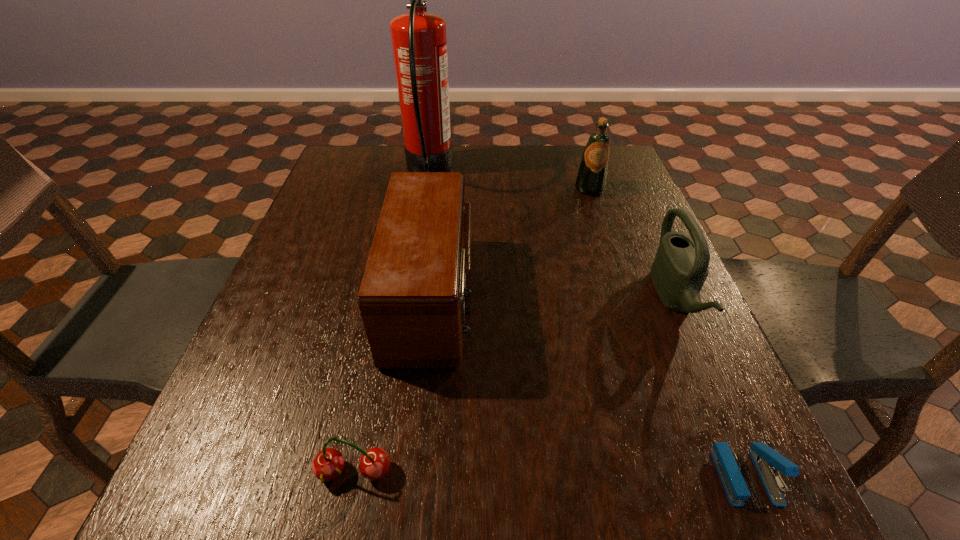
At what (x,y) coordinates should I click in order to perform the action: click on empty space between the radio receiver and the third object from right to left. Please return your answer as a coordinate pair (x, y). This screenshot has width=960, height=540. Looking at the image, I should click on (511, 242).

Image resolution: width=960 pixels, height=540 pixels. I want to click on vacant area that lies between the fire extinguisher and the olive oil, so click(x=510, y=179).

Where is `empty space between the radio receiver and the watering can`? The height and width of the screenshot is (540, 960). empty space between the radio receiver and the watering can is located at coordinates (553, 298).

Find the location of `vacant area that lies between the fourth object from left to right and the cherry`. vacant area that lies between the fourth object from left to right and the cherry is located at coordinates (472, 330).

Where is `blank region between the shortest object and the second shortest object`? blank region between the shortest object and the second shortest object is located at coordinates (550, 474).

Where is `free space between the radio receiver and the stapler`? This screenshot has height=540, width=960. free space between the radio receiver and the stapler is located at coordinates (588, 386).

At what (x,y) coordinates should I click in order to perform the action: click on vacant space that's between the cherry and the third object from right to left. Please return your answer as a coordinate pair (x, y). Looking at the image, I should click on (472, 330).

Identify which object is the second closest to the second shortest object. Please provide its 2D coordinates. Your answer should be formatted as a tuple, i.e. [(x, y)], where the tuple contains the x and y coordinates of a point satisfying the conditions above.

[(767, 461)]

The height and width of the screenshot is (540, 960). I want to click on object that is the second closest to the watering can, so click(591, 179).

This screenshot has width=960, height=540. In order to click on vacant area in the image that satisfies the following two spatial constraints: 1. on the spout of the watering can; 2. with stems pointing upwards on the second shortest object in this screenshot , I will do `click(749, 472)`.